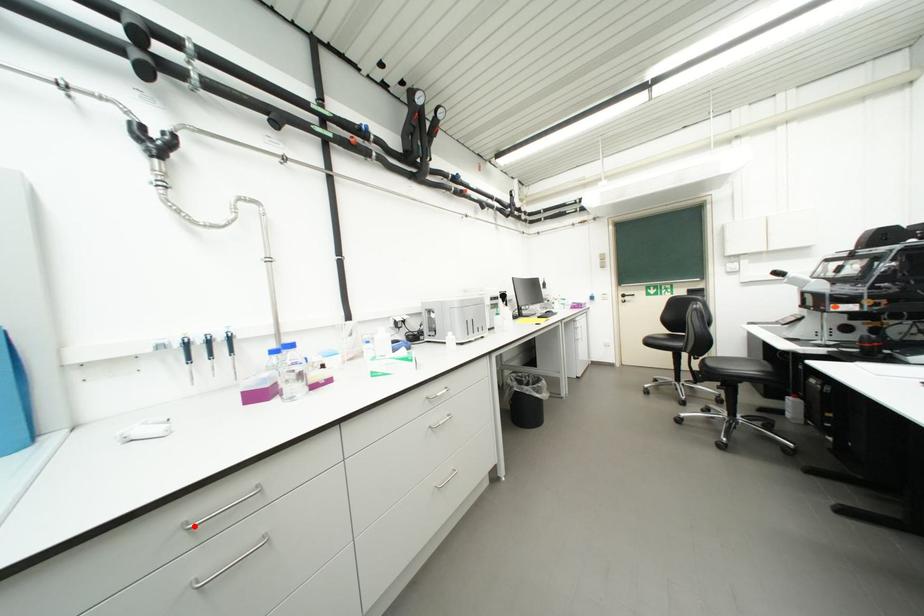
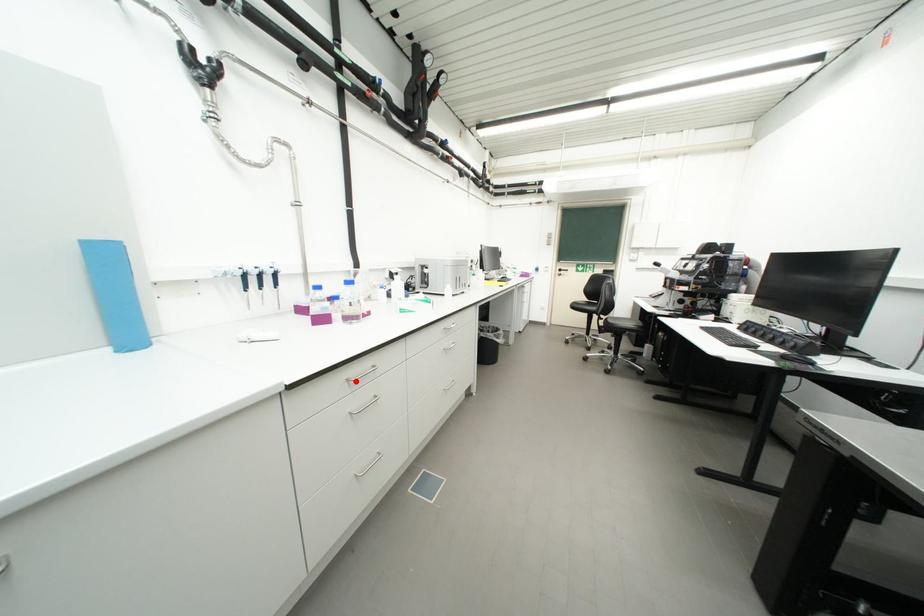
I am providing you with two images of the same scene from different viewpoints. A red point is marked on the first image and another point is marked on the second image. Is the red point in image1 aligned with the point shown in image2?

Yes